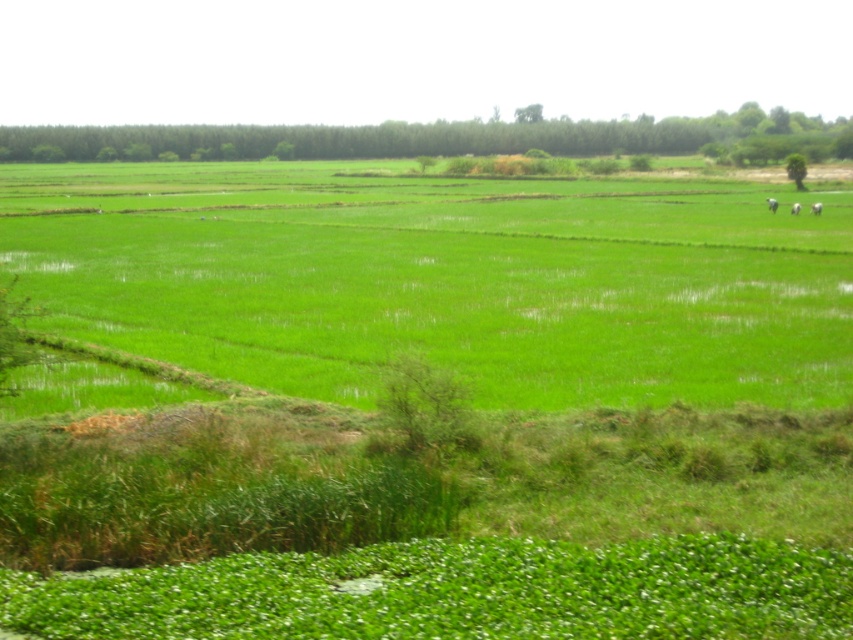
You are a farmer checking the field. You see the green grass at center and the white fluffy sheep at upper right. Which object takes up more space in the image?

The green grass at center takes up more space in the image because it has a larger size compared to the white fluffy sheep at upper right.

You are standing at the edge of the paddy field and see two points marked in the image. The first point is at coordinates point (767, 198) and the second is at point (815, 211). Which point is closer to you?

Point (767, 198) is further to the camera than point (815, 211), so the point closer to you is point (815, 211).